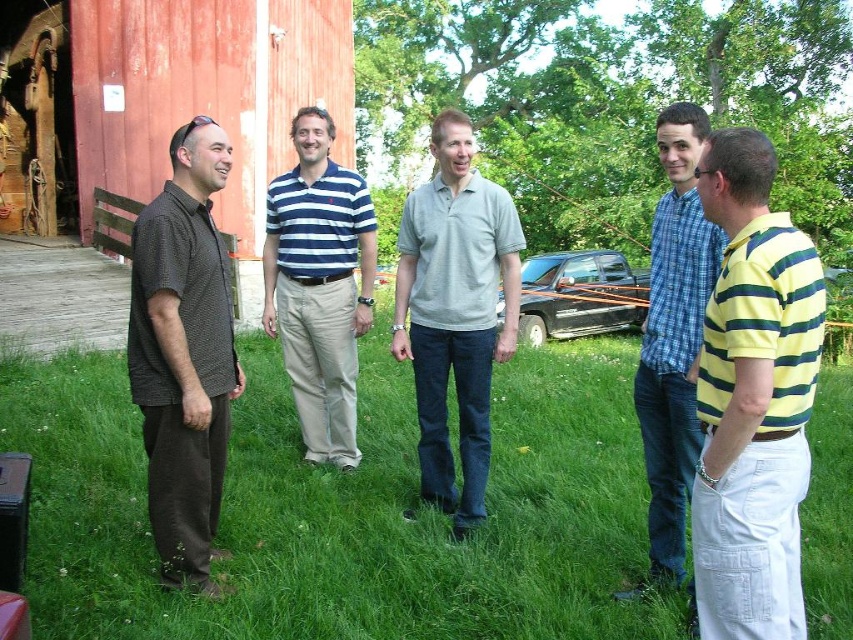
You are a photographer trying to capture a group photo of the dark brown textured shirt at left and the blue striped polo shirt at center. Since you want both subjects to appear equally sized in the photo, which direction should you move the camera relative to the subjects?

The dark brown textured shirt at left is smaller than the blue striped polo shirt at center. To make them appear the same size in the photo, you should move the camera closer to the dark brown textured shirt at left and farther from the blue striped polo shirt at center.

You are standing in the rural setting and see the green grass at center and the blue striped polo shirt at center. Which object is closer to you?

The green grass at center is closer to you since it is in front of the blue striped polo shirt at center.